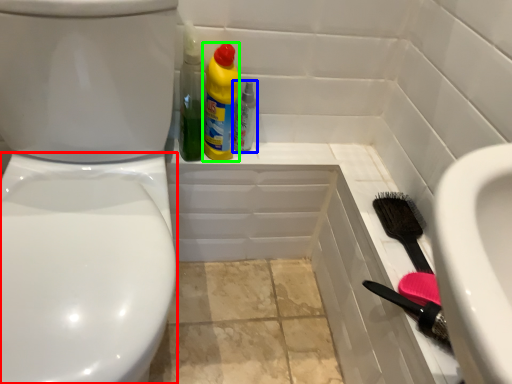
Question: Considering the real-world distances, which object is farthest from bidet (highlighted by a red box)? bottle (highlighted by a blue box) or cleaning product (highlighted by a green box)?

Choices:
 (A) bottle
 (B) cleaning product

Answer: (A)